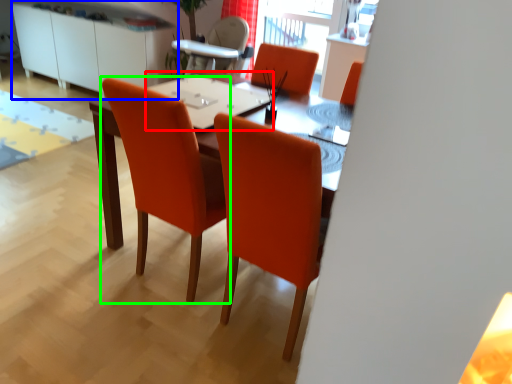
Question: Estimate the real-world distances between objects in this image. Which object is farther from table top (highlighted by a red box), dresser (highlighted by a blue box) or chair (highlighted by a green box)?

Choices:
 (A) dresser
 (B) chair

Answer: (A)